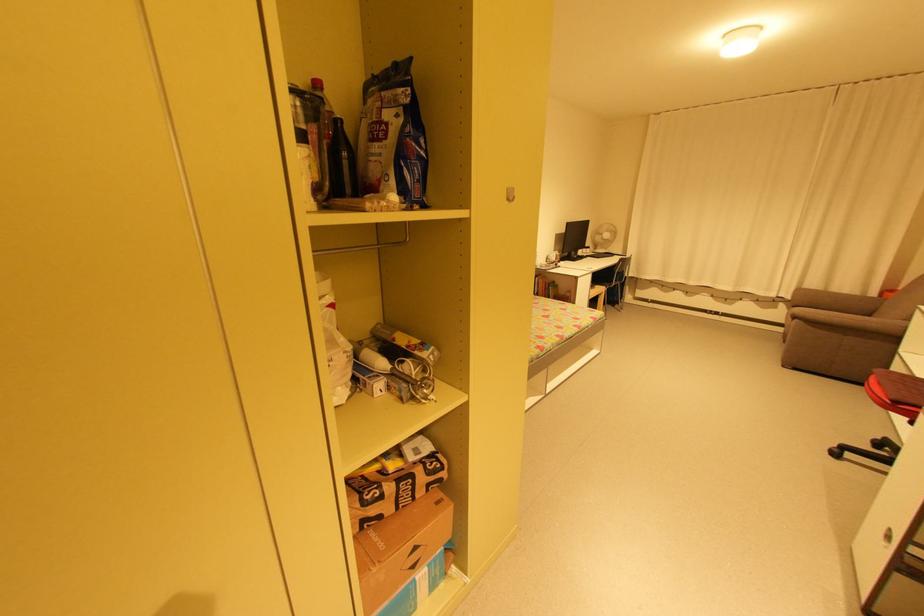
The height and width of the screenshot is (616, 924). Identify the location of white light switch. (509, 193).